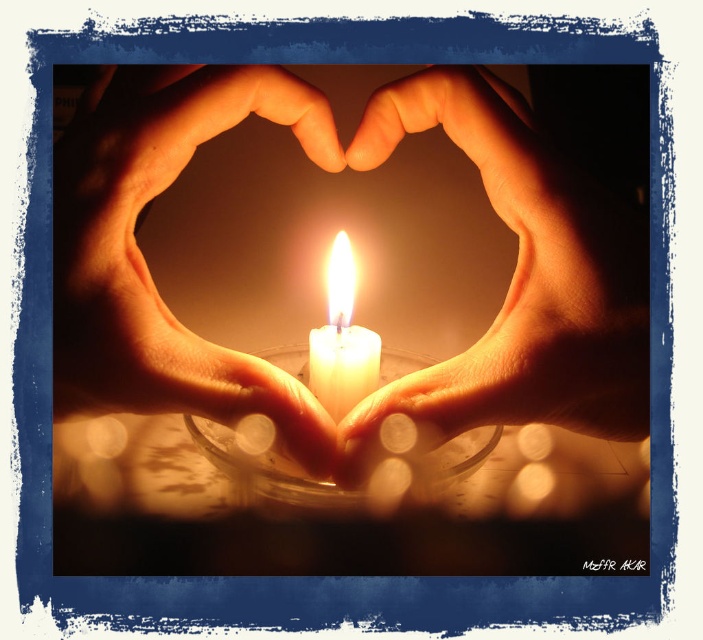
You are a photographer adjusting the camera focus. The scene has a lit candle in a glass holder and hands forming a heart around it. The camera is currently focused on the candle. If you want to shift focus to the hands at the point marked by coordinates (x=143, y=257), will the hands become clearer?

Yes, the hands at center are marked by point (x=143, y=257). Shifting focus to this point would make the hands clearer as they are the target of the focus adjustment.

You are designing a greeting card and want to include the scene with the matte skin hand at center and the white wax candle at center. To ensure the candle is clearly visible, what is the minimum distance you should maintain between the two?

The matte skin hand at center is 4.36 centimeters from the white wax candle at center, so you should maintain at least that distance to ensure the candle remains clearly visible.

Looking at the scene with the matte skin hand at center and the white wax candle at center, which object is positioned to the left?

The white wax candle at center is to the left of the matte skin hand at center.